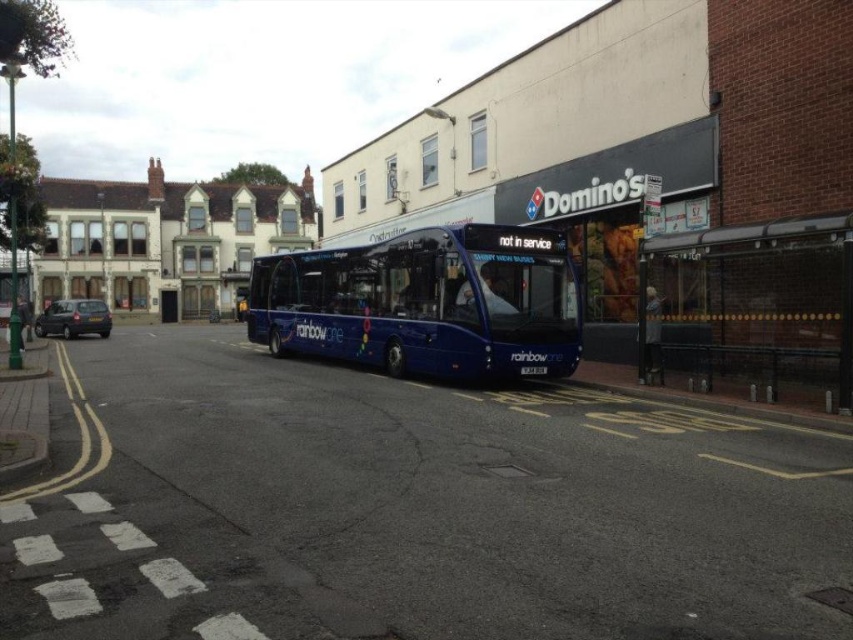
Question: Where is blue metallic bus at center located in relation to transparent plastic bus stop at right in the image?

Choices:
 (A) below
 (B) above

Answer: (A)

Question: Which point is closer to the camera?

Choices:
 (A) blue metallic bus at center
 (B) transparent plastic bus stop at right

Answer: (B)

Question: Is blue metallic bus at center below transparent plastic bus stop at right?

Choices:
 (A) no
 (B) yes

Answer: (B)

Question: From the image, what is the correct spatial relationship of blue metallic bus at center in relation to transparent plastic bus stop at right?

Choices:
 (A) right
 (B) left

Answer: (B)